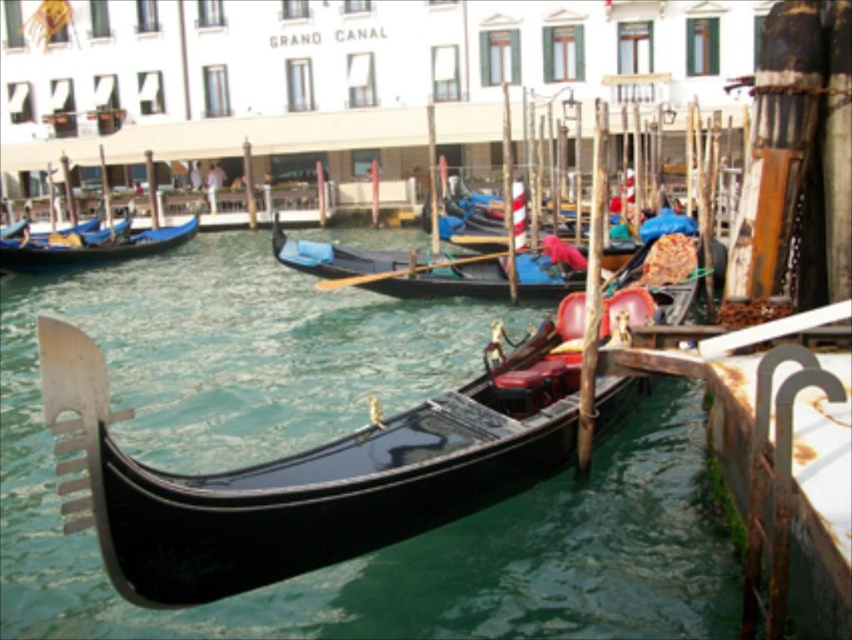
Question: Which point is farther to the camera?

Choices:
 (A) (68, 356)
 (B) (56, 248)
 (C) (346, 252)

Answer: (B)

Question: Is glossy black gondola at center to the left of blue polished wood gondola at left from the viewer's perspective?

Choices:
 (A) yes
 (B) no

Answer: (B)

Question: Does glossy black gondola at center come in front of black polished gondola at center?

Choices:
 (A) yes
 (B) no

Answer: (A)

Question: Can you confirm if glossy black gondola at center is positioned below black polished gondola at center?

Choices:
 (A) yes
 (B) no

Answer: (A)

Question: Which object appears closest to the camera in this image?

Choices:
 (A) blue polished wood gondola at left
 (B) black polished gondola at center
 (C) glossy black gondola at center

Answer: (C)

Question: Which point is closer to the camera?

Choices:
 (A) (422, 522)
 (B) (144, 241)
 (C) (465, 273)

Answer: (A)